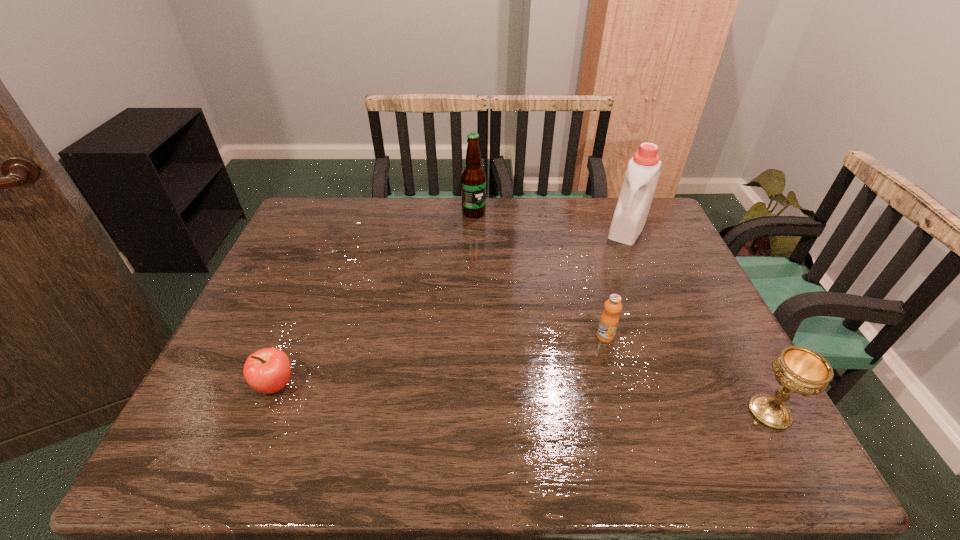
You are a GUI agent. You are given a task and a screenshot of the screen. Output one action in this format:
    pyautogui.click(x=<x>, y=<y>)
    Task: Click on the free space on the desktop that is between the leftmost object and the rightmost object and is positioned on the handle side of the fourth object from left to right
    
    Given the screenshot: What is the action you would take?
    pyautogui.click(x=537, y=400)

In order to click on free space on the desktop that is between the leftmost object and the rightmost object and is positioned on the front label of the third nearest object in this screenshot , I will do `click(571, 402)`.

What are the coordinates of `free spot on the desktop that is between the leftmost object and the chalice and is positioned on the label of the fourth object from right to left` in the screenshot? It's located at (585, 402).